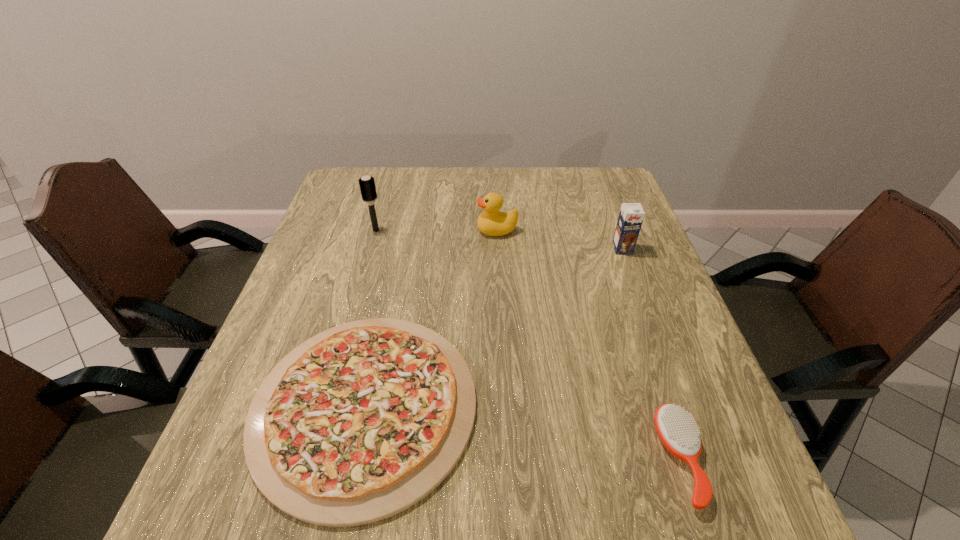
Locate an element on the screen. Image resolution: width=960 pixels, height=540 pixels. free space located at the beak of the third tallest object is located at coordinates (441, 230).

Find the location of a particular element. vacant space located 0.140m at the beak of the third tallest object is located at coordinates (426, 230).

Find the location of `vacant space positioned on the right of the fourth tallest object`. vacant space positioned on the right of the fourth tallest object is located at coordinates click(x=742, y=459).

Where is `blank space located 0.280m on the right of the pizza`? The height and width of the screenshot is (540, 960). blank space located 0.280m on the right of the pizza is located at coordinates (626, 406).

Find the location of `hairbrush positioned at the near edge`. hairbrush positioned at the near edge is located at coordinates (678, 432).

This screenshot has width=960, height=540. In order to click on pizza that is positioned at the near edge in this screenshot , I will do `click(360, 422)`.

Image resolution: width=960 pixels, height=540 pixels. Find the location of `hairbrush that is at the left edge`. hairbrush that is at the left edge is located at coordinates (367, 185).

Locate an element on the screen. The height and width of the screenshot is (540, 960). pizza that is at the left edge is located at coordinates (360, 422).

You are a GUI agent. You are given a task and a screenshot of the screen. Output one action in this format:
    pyautogui.click(x=<x>, y=<y>)
    Task: Click on the chocolate milk positioned at the right edge
    Image resolution: width=960 pixels, height=540 pixels.
    Given the screenshot: What is the action you would take?
    pyautogui.click(x=631, y=215)

Locate an element on the screen. Image resolution: width=960 pixels, height=540 pixels. hairbrush located in the right edge section of the desktop is located at coordinates (678, 432).